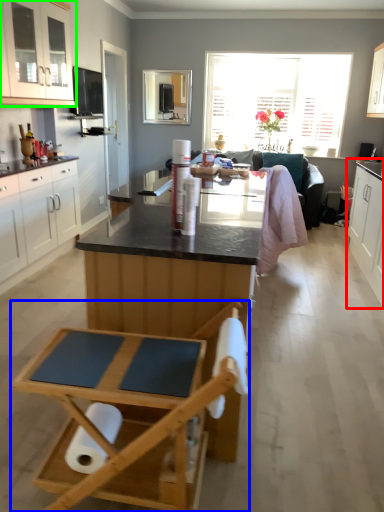
Question: Which object is positioned closest to cabinetry (highlighted by a red box)? Select from folding chair (highlighted by a blue box) and cabinetry (highlighted by a green box).

Choices:
 (A) folding chair
 (B) cabinetry

Answer: (A)